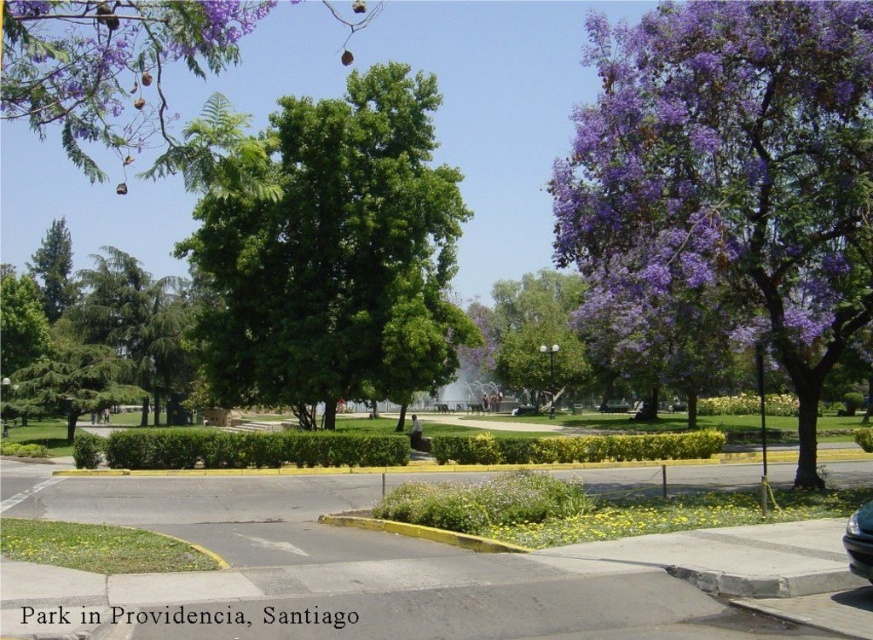
Question: Does purple leafy tree at right have a smaller size compared to green leafy tree at upper left?

Choices:
 (A) yes
 (B) no

Answer: (A)

Question: Where is green leafy tree at center located in relation to green leafy tree at upper left in the image?

Choices:
 (A) left
 (B) right

Answer: (B)

Question: Which object is the farthest from the shiny black car at lower right?

Choices:
 (A) green leafy tree at center
 (B) green matte tree at left

Answer: (B)

Question: Observing the image, what is the correct spatial positioning of purple leafy tree at right in reference to green leafy tree at center?

Choices:
 (A) above
 (B) below

Answer: (B)

Question: Considering the real-world distances, which object is farthest from the green matte tree at left?

Choices:
 (A) shiny black car at lower right
 (B) purple leafy tree at right
 (C) green leafy tree at center
 (D) green leafy tree at upper left

Answer: (A)

Question: Which object is positioned closest to the shiny black car at lower right?

Choices:
 (A) green leafy tree at center
 (B) green matte tree at left
 (C) purple leafy tree at right

Answer: (C)